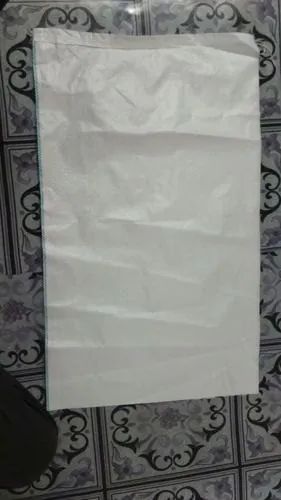
Identify the location of tile. (164, 450).